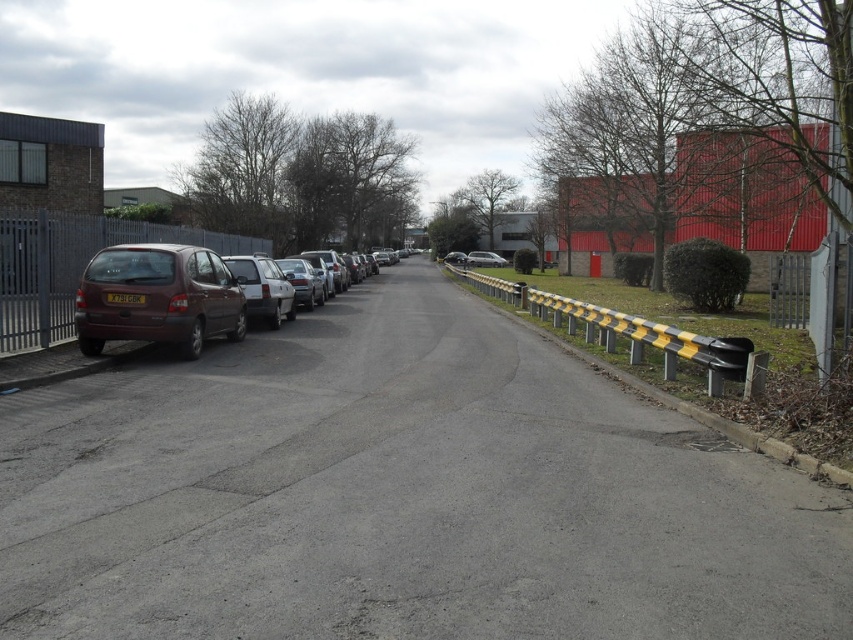
Where is `matte dark brown hatchback at left`? Image resolution: width=853 pixels, height=640 pixels. matte dark brown hatchback at left is located at coordinates (175, 296).

Measure the distance between matte dark brown hatchback at left and matte brown minivan at left.

They are 1.73 meters apart.

Where is `matte dark brown hatchback at left`? This screenshot has width=853, height=640. matte dark brown hatchback at left is located at coordinates (175, 296).

Can you confirm if matte brown minivan at left is positioned to the right of silver metallic sedan at center?

No, matte brown minivan at left is not to the right of silver metallic sedan at center.

Does matte brown minivan at left come in front of silver metallic sedan at center?

Yes, it is in front of silver metallic sedan at center.

Is point (173, 291) positioned behind point (505, 259)?

No.

This screenshot has height=640, width=853. Find the location of `matte brown minivan at left`. matte brown minivan at left is located at coordinates (157, 298).

Between matte dark brown hatchback at left and silver metallic sedan at center, which one is positioned higher?

silver metallic sedan at center

Between point (215, 288) and point (486, 252), which one is positioned in front?

Point (215, 288) is in front.

You are a GUI agent. You are given a task and a screenshot of the screen. Output one action in this format:
    pyautogui.click(x=<x>, y=<y>)
    Task: Click on the matte dark brown hatchback at left
    The height and width of the screenshot is (640, 853).
    Given the screenshot: What is the action you would take?
    pyautogui.click(x=175, y=296)